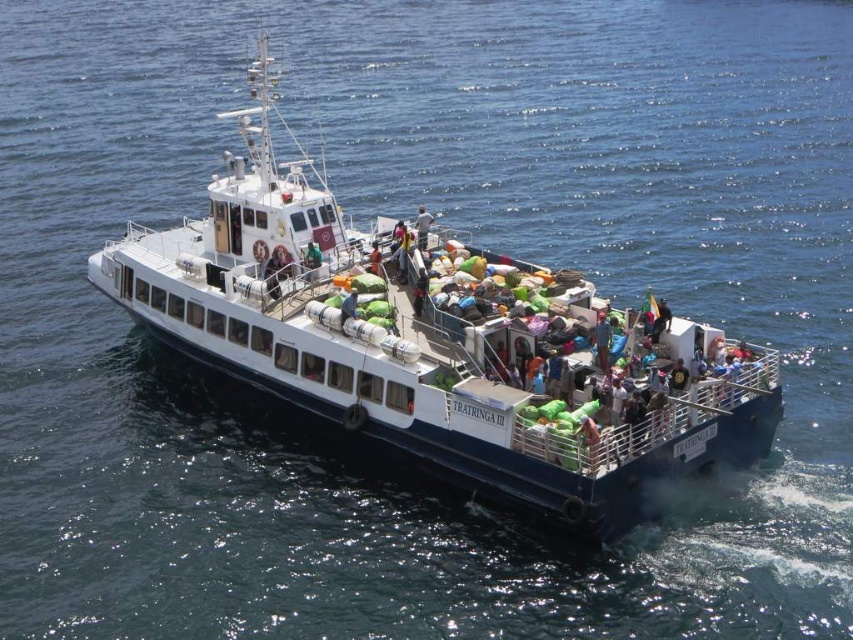
You are standing on the deck of the ferry TRATRINGA III and want to throw a frisbee to your friend who is also on the deck. The distance between you and your friend is 42.77 meters. Is this distance longer than the length of the white matte boat at center?

The distance between you and your friend is 42.77 meters, which is longer than the length of the white matte boat at center. Therefore, the distance is indeed longer than the boat.